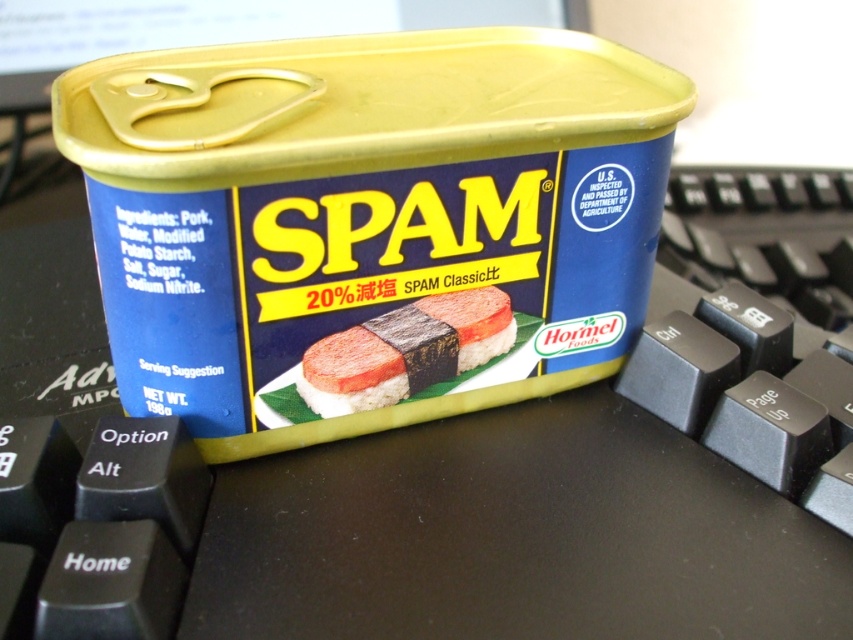
Between yellow matte plastic can at center and pinkish-red soft-textured spam at center, which one has less height?

Standing shorter between the two is pinkish-red soft-textured spam at center.

You are a GUI agent. You are given a task and a screenshot of the screen. Output one action in this format:
    pyautogui.click(x=<x>, y=<y>)
    Task: Click on the yellow matte plastic can at center
    
    Given the screenshot: What is the action you would take?
    pyautogui.click(x=368, y=221)

At what (x,y) coordinates should I click in order to perform the action: click on yellow matte plastic can at center. Please return your answer as a coordinate pair (x, y). The width and height of the screenshot is (853, 640). Looking at the image, I should click on (368, 221).